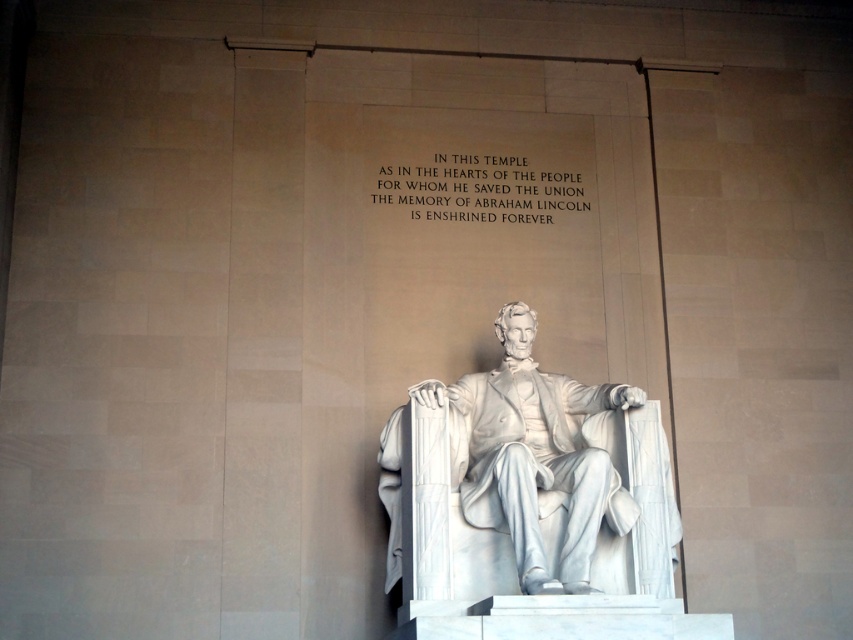
You are standing at the entrance of the Lincoln Memorial and want to take a photo of the white marble statue at center. If your camera can focus on objects up to 30 meters away, will you be able to take a clear photo of the statue?

The white marble statue at center is 35.68 meters from viewer. Since the statue is farther than 30 meters, your camera cannot focus on it clearly. Move closer to take a clear photo.

You are a tour guide explaining the Lincoln Memorial to a group. You mention both the white marble statue at center and the white stone text at upper center. Which one is wider?

The white marble statue at center is wider than the white stone text at upper center.

You are a tour guide explaining the Lincoln Memorial to visitors. You point out the white marble statue at center and the white stone text at upper center. Which object is closer to the visitors standing at the entrance?

The white marble statue at center is closer to the visitors standing at the entrance because it is positioned in front of the white stone text at upper center.